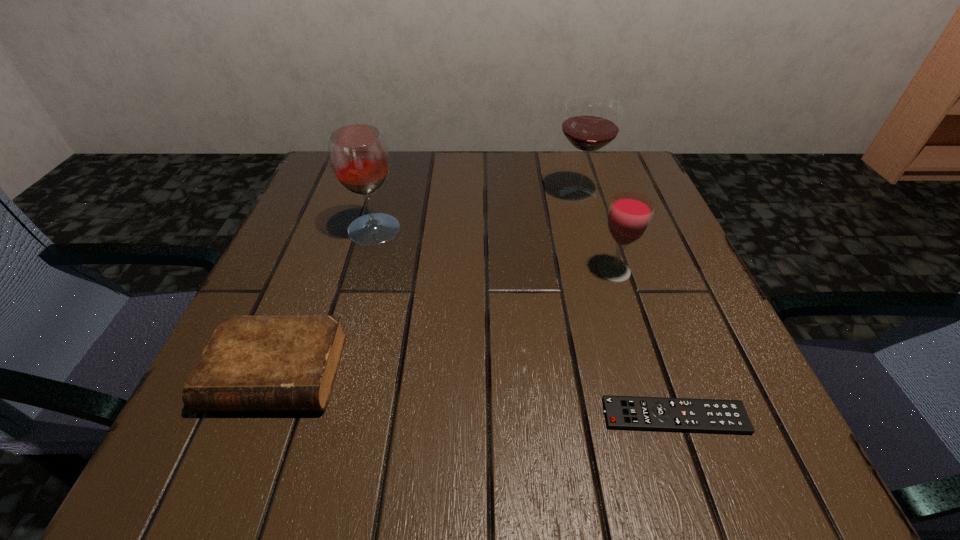
At what (x,y) coordinates should I click in order to perform the action: click on the leftmost wineglass. Please return your answer as a coordinate pair (x, y). Looking at the image, I should click on (359, 159).

You are a GUI agent. You are given a task and a screenshot of the screen. Output one action in this format:
    pyautogui.click(x=<x>, y=<y>)
    Task: Click on the fourth nearest object
    
    Given the screenshot: What is the action you would take?
    359,159

The image size is (960, 540). I want to click on the farthest object, so click(591, 123).

The width and height of the screenshot is (960, 540). What are the coordinates of `the third tallest object` in the screenshot? It's located at (629, 216).

Image resolution: width=960 pixels, height=540 pixels. In order to click on the nearest wineglass in this screenshot , I will do `click(629, 216)`.

You are a GUI agent. You are given a task and a screenshot of the screen. Output one action in this format:
    pyautogui.click(x=<x>, y=<y>)
    Task: Click on the diary
    This screenshot has height=540, width=960.
    Given the screenshot: What is the action you would take?
    pyautogui.click(x=251, y=363)

The width and height of the screenshot is (960, 540). In order to click on the shortest object in this screenshot , I will do `click(716, 416)`.

Where is `vacant space located 0.400m on the right of the leftmost wineglass`? The width and height of the screenshot is (960, 540). vacant space located 0.400m on the right of the leftmost wineglass is located at coordinates (599, 230).

In order to click on vacant space located on the back of the farthest wineglass in this screenshot , I will do click(571, 170).

Identify the location of blank space located 0.170m on the back of the third tallest object. (593, 206).